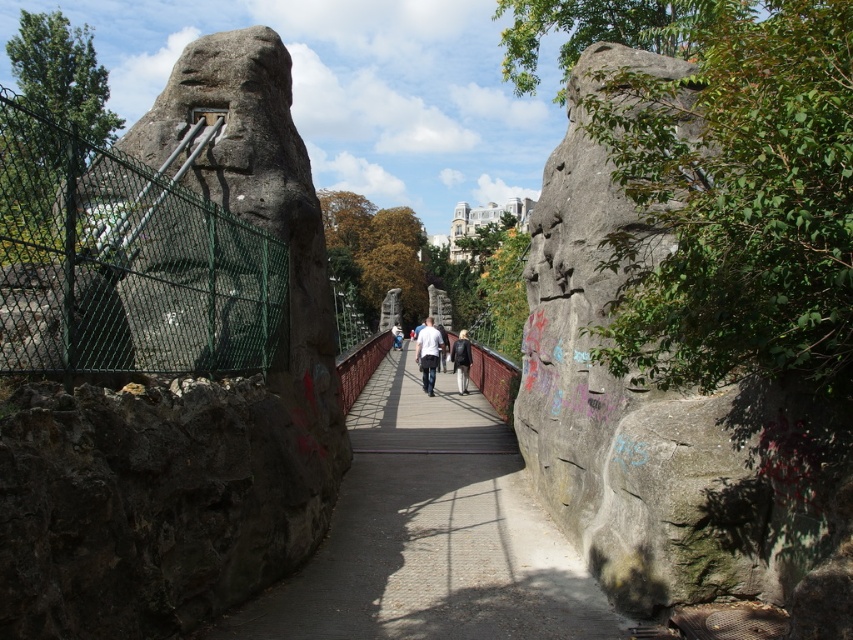
You are a hiker standing on the wooden bridge at center. Looking towards the gray rough rock at right, which structure appears taller from your perspective?

The gray rough rock at right is much taller than the wooden bridge at center, so from your perspective on the wooden bridge at center, the gray rough rock at right would appear taller.

You are standing on the wooden bridge at center and want to take a photo of the gray rough rock at right. Since the rock is closer to you, will it appear larger or smaller in the photo compared to if it were farther away?

The gray rough rock at right is closer to the viewer than the wooden bridge at center, so it will appear larger in the photo than if it were farther away.